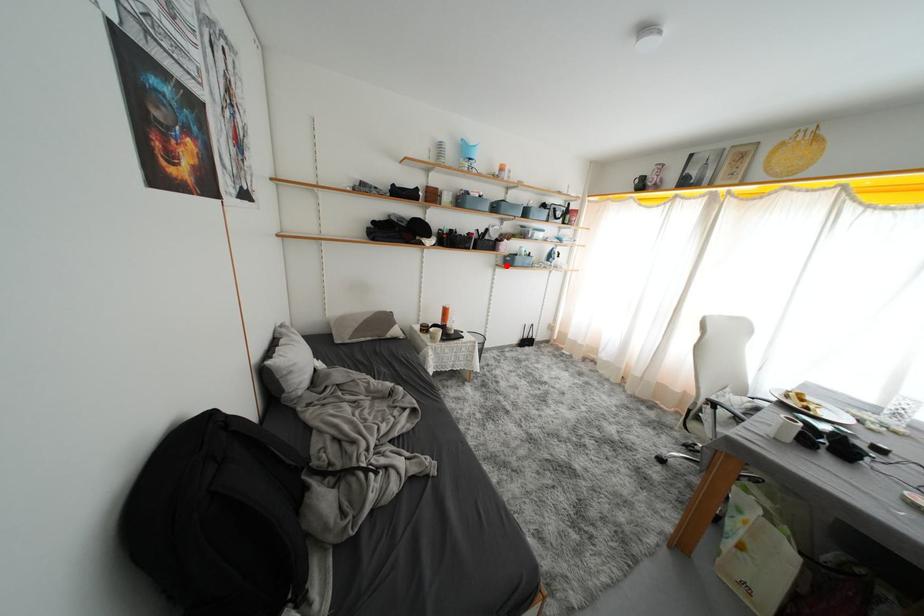
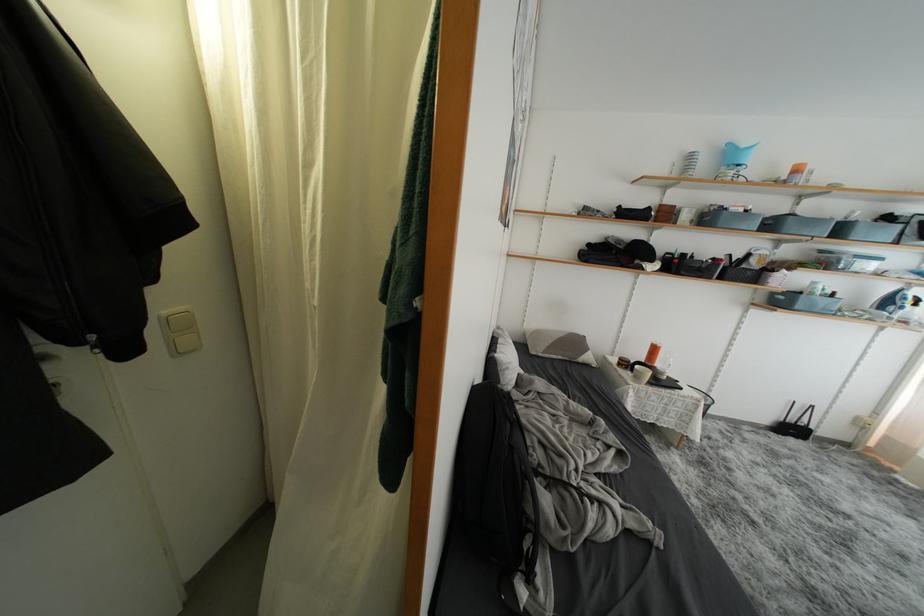
Find the pixel in the second image that matches the highlighted location in the first image.

(767, 304)